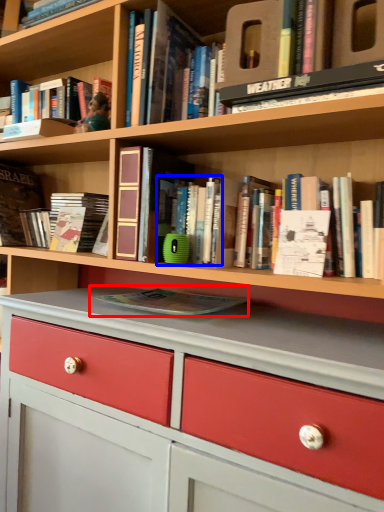
Question: Among these objects, which one is farthest to the camera, book (highlighted by a red box) or book (highlighted by a blue box)?

Choices:
 (A) book
 (B) book

Answer: (B)